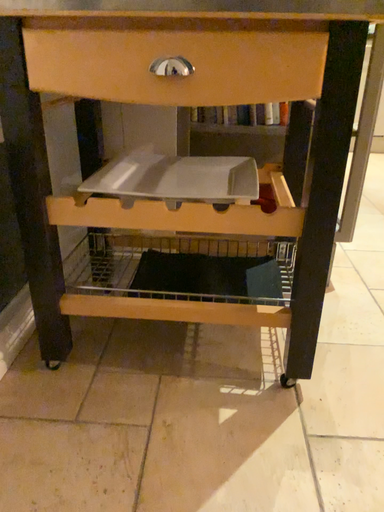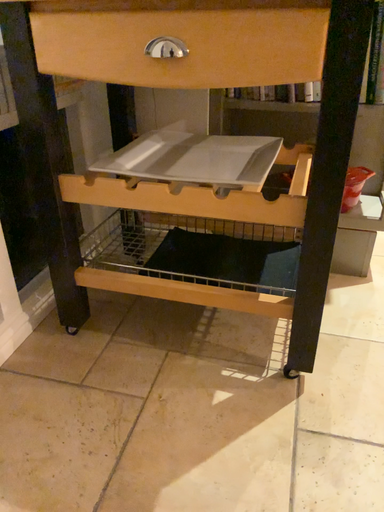
Question: How did the camera likely rotate when shooting the video?

Choices:
 (A) rotated left
 (B) rotated right

Answer: (A)